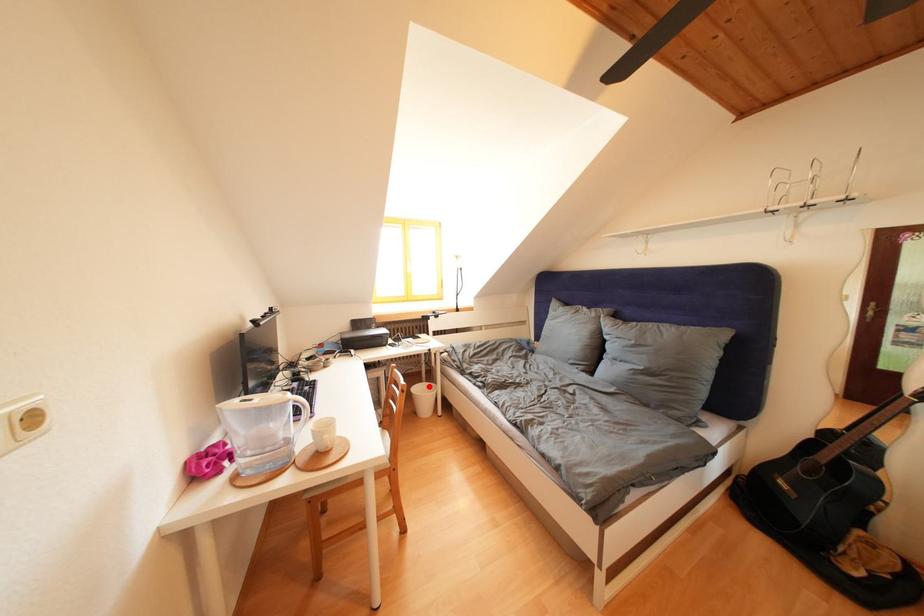
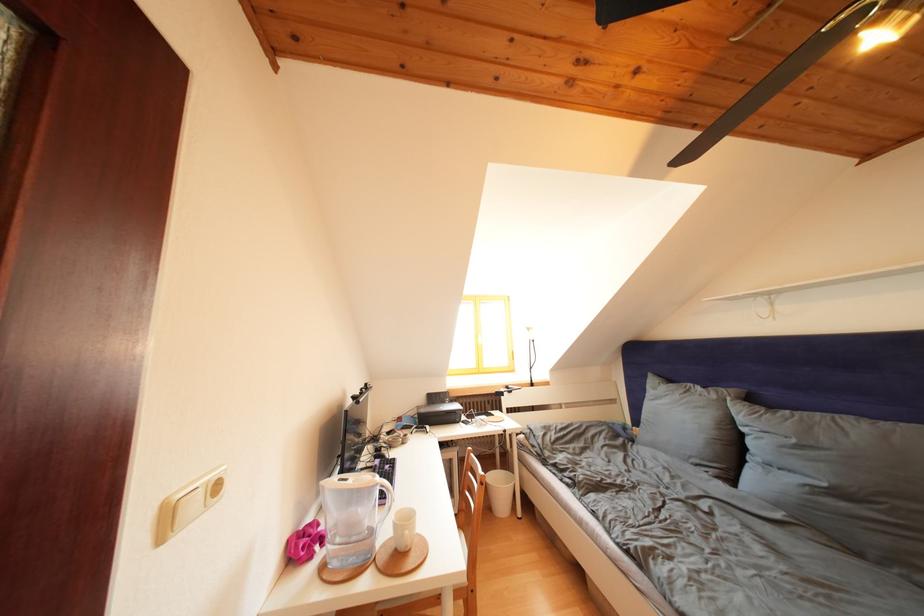
Question: I am providing you with two images of the same scene from different viewpoints. A red point is marked on the first image. At the location where the point appears in image 1, is it still visible in image 2?

Choices:
 (A) Yes
 (B) No

Answer: (A)